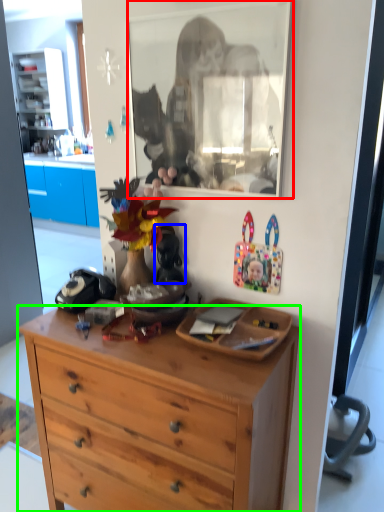
Question: Which object is positioned closest to mirror (highlighted by a red box)? Select from toy (highlighted by a blue box) and desk (highlighted by a green box).

Choices:
 (A) toy
 (B) desk

Answer: (A)